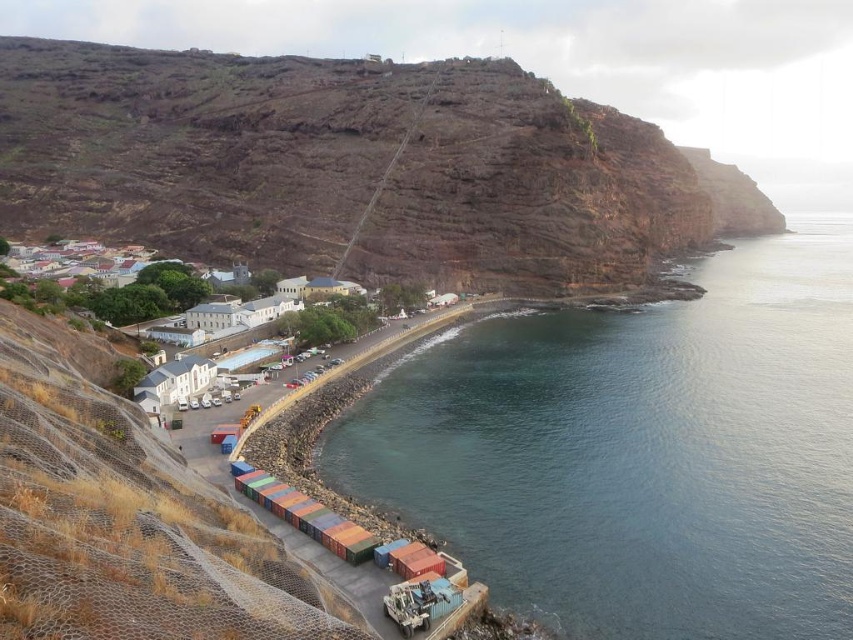
Question: Does blue water at lower right appear over brown rocky cliff at upper left?

Choices:
 (A) yes
 (B) no

Answer: (B)

Question: Which point is closer to the camera taking this photo?

Choices:
 (A) (113, 148)
 (B) (636, 625)

Answer: (B)

Question: Is blue water at lower right to the right of brown rocky cliff at upper left from the viewer's perspective?

Choices:
 (A) yes
 (B) no

Answer: (A)

Question: In this image, where is blue water at lower right located relative to brown rocky cliff at upper left?

Choices:
 (A) above
 (B) below

Answer: (B)

Question: Which point appears closest to the camera in this image?

Choices:
 (A) (21, 51)
 (B) (825, 525)

Answer: (B)